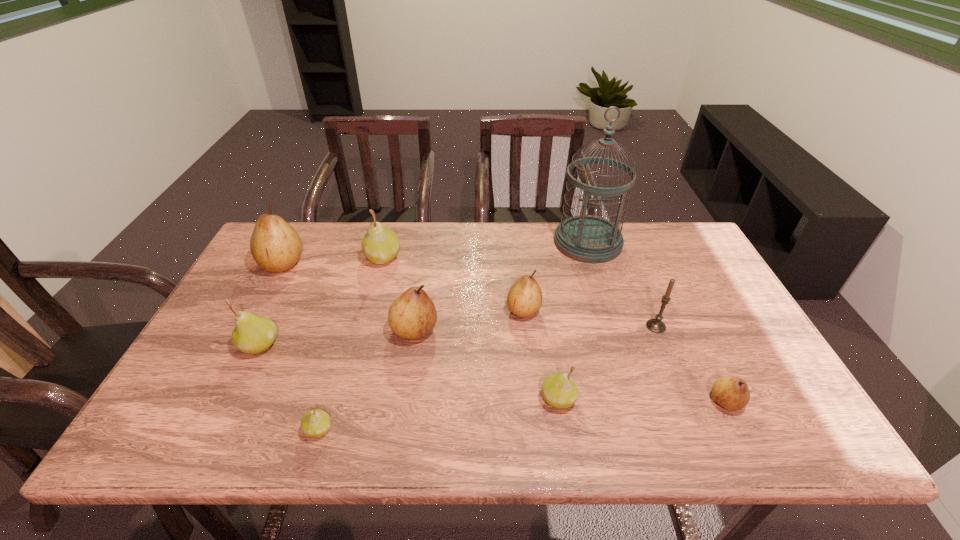
Where is `brown pear that stands as the third closest to the second smallest brown pear`? brown pear that stands as the third closest to the second smallest brown pear is located at coordinates (276, 247).

You are a GUI agent. You are given a task and a screenshot of the screen. Output one action in this format:
    pyautogui.click(x=<x>, y=<y>)
    Task: Click on the free spot that satisfies the following two spatial constraints: 1. on the front-facing side of the tallest object; 2. on the left side of the gray candle
    This screenshot has width=960, height=540.
    Given the screenshot: What is the action you would take?
    click(613, 326)

Find the location of a particular element. The height and width of the screenshot is (540, 960). vacant region that satisfies the following two spatial constraints: 1. on the back side of the nearest object; 2. on the right side of the rightmost green pear is located at coordinates (327, 399).

Find the location of a particular element. This screenshot has height=540, width=960. free spot that satisfies the following two spatial constraints: 1. on the back side of the second brown pear from right to left; 2. on the left side of the smallest green pear is located at coordinates (354, 310).

Image resolution: width=960 pixels, height=540 pixels. I want to click on free space that satisfies the following two spatial constraints: 1. on the front side of the rightmost brown pear; 2. on the right side of the second smallest brown pear, so click(x=533, y=401).

The height and width of the screenshot is (540, 960). I want to click on vacant space that satisfies the following two spatial constraints: 1. on the back side of the nearest object; 2. on the right side of the second smallest brown pear, so click(x=354, y=310).

Identify the location of free point that satisfies the following two spatial constraints: 1. on the back side of the second smallest brown pear; 2. on the left side of the leftmost green pear. (276, 310).